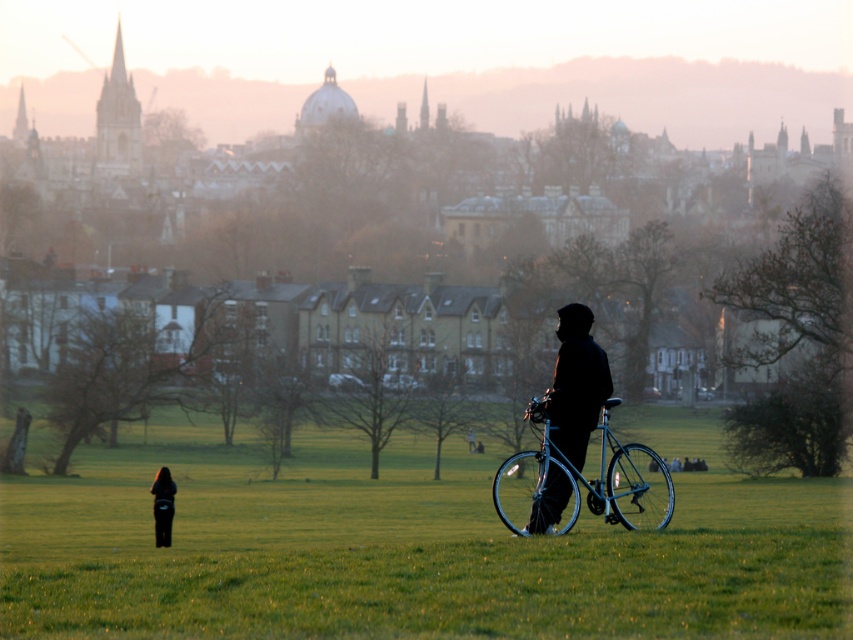
How much distance is there between metallic bicycle at center and dark fabric jacket at lower left?

They are 18.21 meters apart.

Is point (503, 582) less distant than point (161, 536)?

Yes, point (503, 582) is in front of point (161, 536).

Does point (335, 592) lie in front of point (167, 477)?

Yes, it is in front of point (167, 477).

You are a GUI agent. You are given a task and a screenshot of the screen. Output one action in this format:
    pyautogui.click(x=<x>, y=<y>)
    Task: Click on the metallic bicycle at center
    The height and width of the screenshot is (640, 853).
    Given the screenshot: What is the action you would take?
    pyautogui.click(x=405, y=554)

What do you see at coordinates (576, 384) in the screenshot? I see `silhouette fabric jacket at center` at bounding box center [576, 384].

Does silhouette fabric jacket at center come in front of dark fabric jacket at lower left?

That is True.

What do you see at coordinates (576, 384) in the screenshot?
I see `silhouette fabric jacket at center` at bounding box center [576, 384].

Locate an element on the screen. This screenshot has height=640, width=853. silhouette fabric jacket at center is located at coordinates (576, 384).

Between metallic bicycle at center and silhouette fabric jacket at center, which one is positioned lower?

Positioned lower is metallic bicycle at center.

Between metallic bicycle at center and silhouette fabric jacket at center, which one appears on the left side from the viewer's perspective?

From the viewer's perspective, metallic bicycle at center appears more on the left side.

Identify the location of metallic bicycle at center. This screenshot has height=640, width=853. (405, 554).